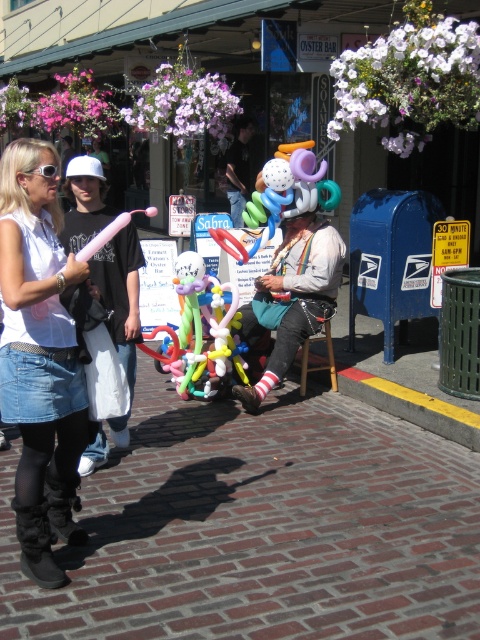
You are a delivery robot with a 30 feet maximum delivery range. You are positioned at the shiny black jacket at center and need to deliver a package to the denim skirt at lower left. Can you complete the delivery within your range?

The distance between the shiny black jacket at center and denim skirt at lower left is 35.94 feet, which exceeds the delivery robot maximum range of 30 feet. Therefore, the delivery cannot be completed within the range.

You are a delivery person carrying a large box that is 2 meters in length. You need to walk through the street scene shown in the image. Can you pass between the brick pavement at lower center and the shiny black jacket at center without the box hitting either? Explain your reasoning.

The brick pavement at lower center has a larger size compared to the shiny black jacket at center. However, the description does not provide specific measurements of the distance between them. Therefore, it is uncertain whether the 2 meter box can pass without hitting either object.